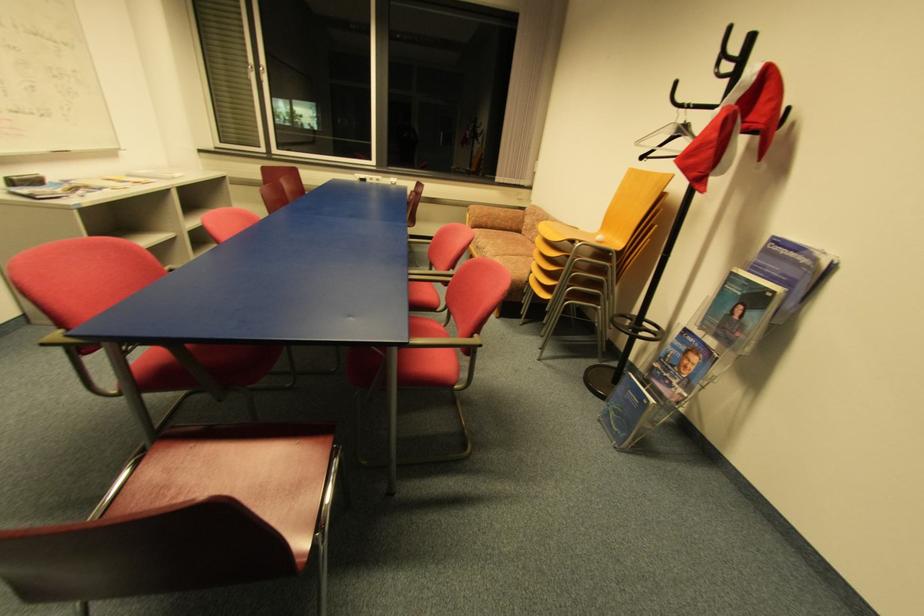
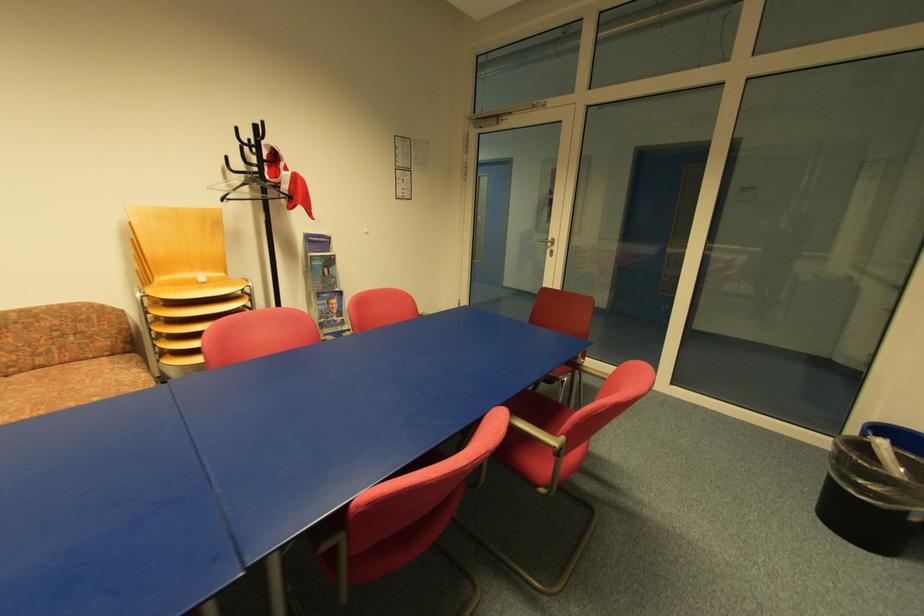
Locate, in the second image, the point that corresponds to (x=739, y=318) in the first image.

(331, 275)